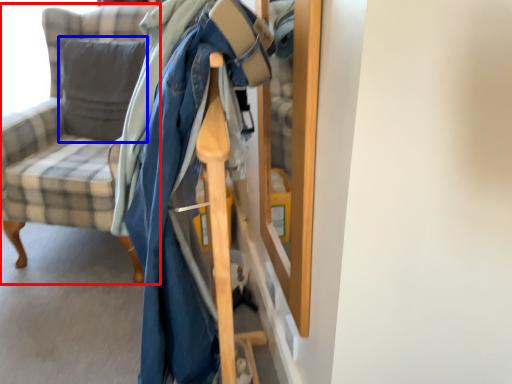
Question: Which object appears farthest to the camera in this image, chair (highlighted by a red box) or pillow (highlighted by a blue box)?

Choices:
 (A) chair
 (B) pillow

Answer: (B)